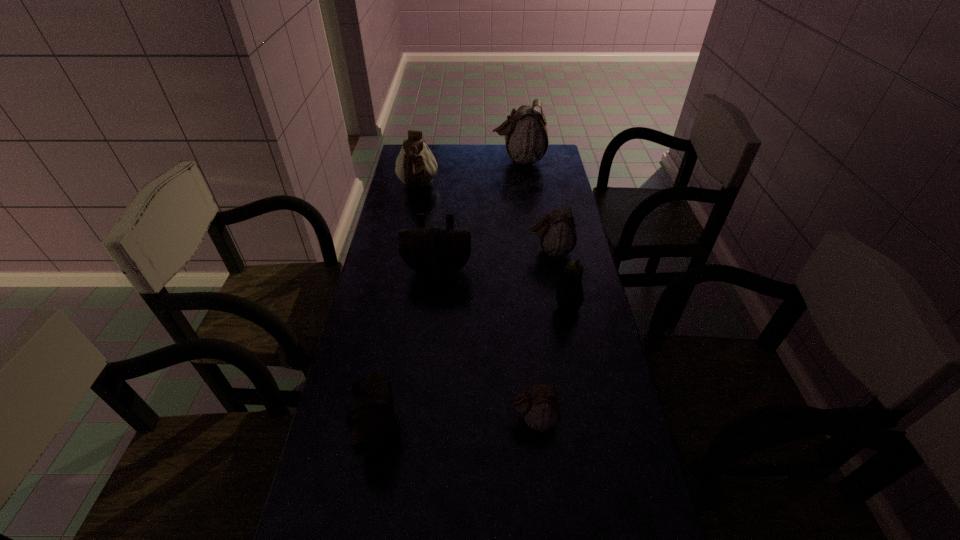
In order to click on vacant area located on the front-facing side of the smallest white pouch in this screenshot , I will do `click(354, 419)`.

This screenshot has width=960, height=540. In order to click on free space located 0.270m on the front-facing side of the smallest white pouch in this screenshot , I will do point(399,419).

The height and width of the screenshot is (540, 960). In order to click on vacant region located 0.340m on the front-facing side of the smallest white pouch in this screenshot , I will do `click(371, 419)`.

This screenshot has width=960, height=540. What are the coordinates of `object that is at the far edge` in the screenshot? It's located at tap(526, 137).

The height and width of the screenshot is (540, 960). Find the location of `eggplant located at the right edge`. eggplant located at the right edge is located at coordinates (569, 295).

Locate an element on the screen. object present at the far right corner is located at coordinates (526, 137).

The height and width of the screenshot is (540, 960). What are the coordinates of `free space at the left edge of the desktop` in the screenshot? It's located at (375, 322).

The image size is (960, 540). In order to click on blank space at the right edge of the desktop in this screenshot , I will do click(546, 213).

Image resolution: width=960 pixels, height=540 pixels. Identify the location of vacant area at the far right corner. pos(563,164).

Locate an element on the screen. vacant space that's between the third smallest white pouch and the second nearest white pouch is located at coordinates [484, 219].